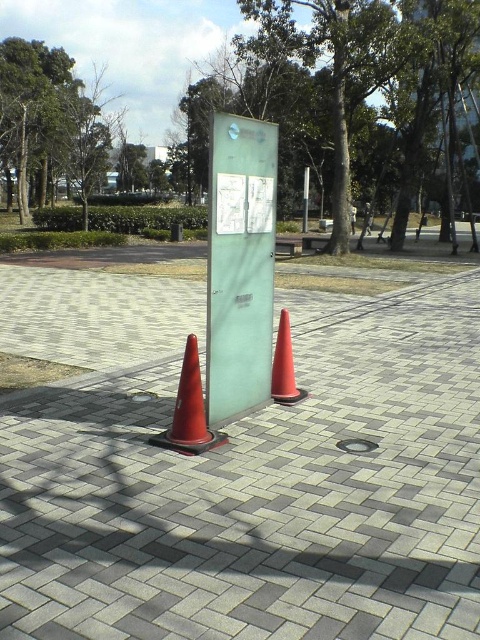
You are a delivery person trying to navigate to the green glass sign at center. You see an orange matte traffic cone at center in your path. Which direction should you move to avoid the cone and reach the sign?

The green glass sign at center is to the left of the orange matte traffic cone at center, so you should move to the left to avoid the cone and reach the sign.

You are a delivery person trying to navigate through the park. You see the green glass sign at center and the orange matte traffic cone at center. Which object is wider?

The green glass sign at center is wider than the orange matte traffic cone at center.